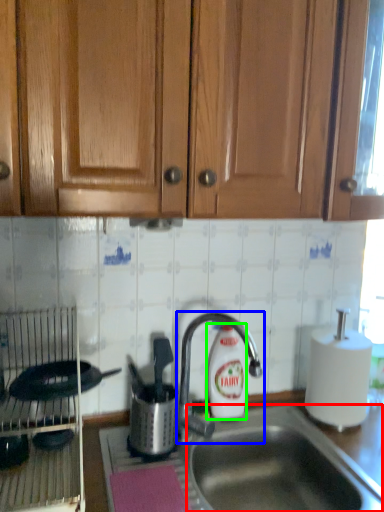
Question: Which object is the farthest from sink (highlighted by a red box)? Choose among these: tap (highlighted by a blue box) or cleaning product (highlighted by a green box).

Choices:
 (A) tap
 (B) cleaning product

Answer: (A)